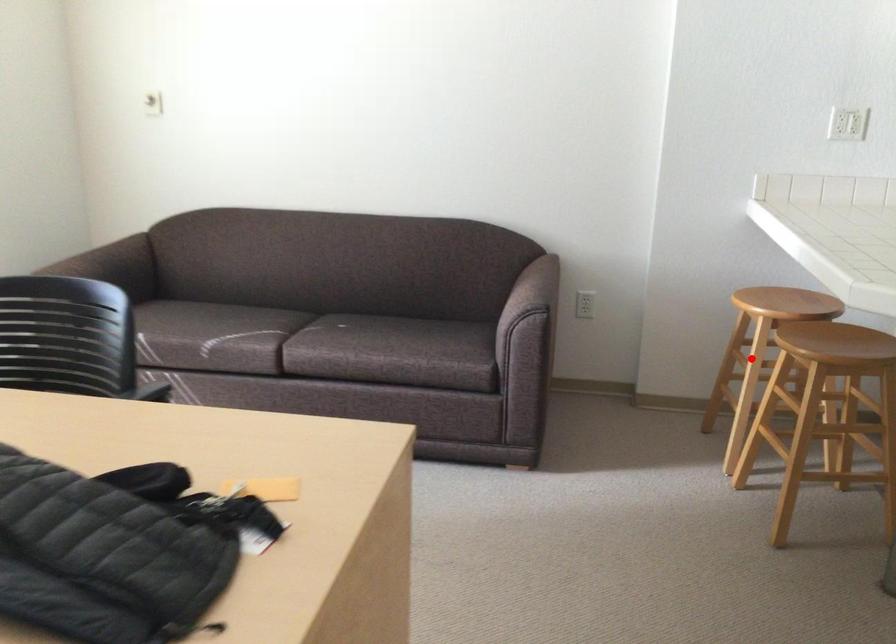
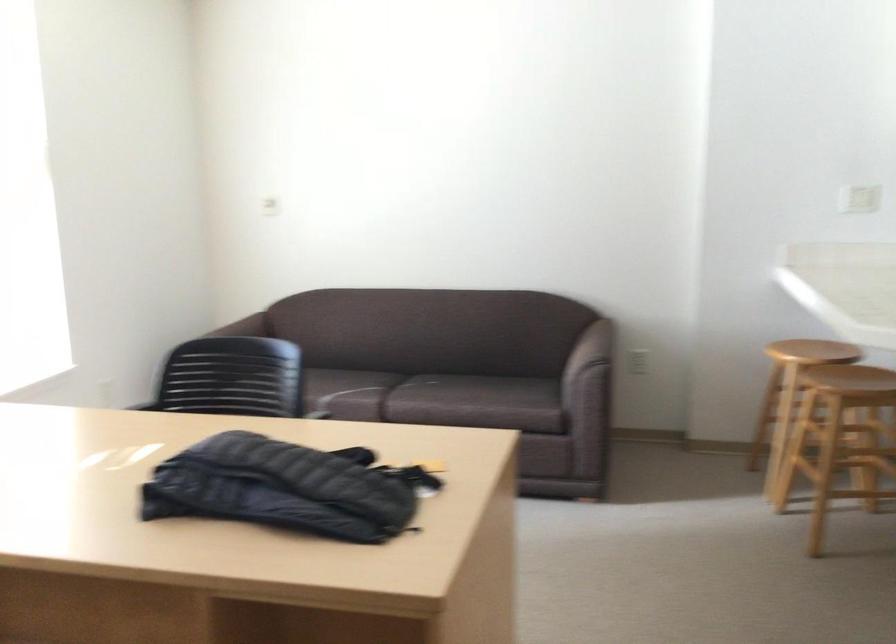
Locate, in the second image, the point that corresponds to the highlighted location in the first image.

(789, 395)